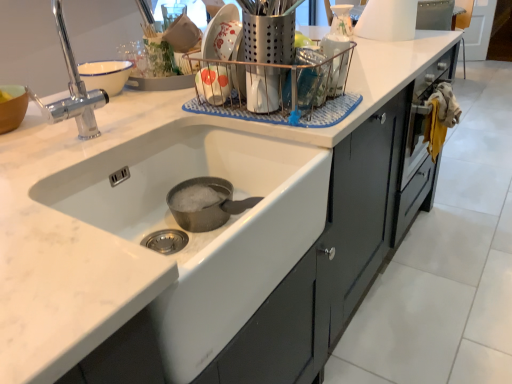
Question: From a real-world perspective, is white glossy sink at center below clear plastic container at upper center, the third appliance in the back-to-front sequence?

Choices:
 (A) yes
 (B) no

Answer: (A)

Question: Is white glossy sink at center further to camera compared to clear plastic container at upper center, the third appliance in the back-to-front sequence?

Choices:
 (A) no
 (B) yes

Answer: (A)

Question: Is white glossy sink at center not within clear plastic container at upper center, the third appliance viewed from the right?

Choices:
 (A) no
 (B) yes

Answer: (B)

Question: Can you confirm if white glossy sink at center is positioned to the left of clear plastic container at upper center, the third appliance viewed from the right?

Choices:
 (A) yes
 (B) no

Answer: (A)

Question: Is white glossy sink at center not near clear plastic container at upper center, marked as the 2th appliance in a front-to-back arrangement?

Choices:
 (A) yes
 (B) no

Answer: (B)

Question: Is clear plastic container at upper center, the second appliance in the left-to-right sequence, in front of or behind white glossy paper towel dispenser at upper right, arranged as the second appliance when viewed from the back, in the image?

Choices:
 (A) front
 (B) behind

Answer: (A)

Question: Based on their positions, is clear plastic container at upper center, marked as the 2th appliance in a front-to-back arrangement, located to the left or right of white glossy paper towel dispenser at upper right, which ranks as the 3th appliance in front-to-back order?

Choices:
 (A) right
 (B) left

Answer: (B)

Question: Is clear plastic container at upper center, the third appliance in the back-to-front sequence, taller or shorter than white glossy paper towel dispenser at upper right, which is the fourth appliance from left to right?

Choices:
 (A) short
 (B) tall

Answer: (A)

Question: Looking at their shapes, would you say clear plastic container at upper center, marked as the 2th appliance in a front-to-back arrangement, is wider or thinner than white glossy paper towel dispenser at upper right, placed as the 1th appliance when sorted from right to left?

Choices:
 (A) wide
 (B) thin

Answer: (B)

Question: From the image's perspective, is white glossy coffee pot at upper center, acting as the third appliance starting from the left, located above or below satin silver utensil holder at upper center, acting as the first appliance starting from the left?

Choices:
 (A) below
 (B) above

Answer: (B)

Question: From their relative heights in the image, would you say white glossy coffee pot at upper center, acting as the third appliance starting from the left, is taller or shorter than satin silver utensil holder at upper center, the first appliance positioned from the front?

Choices:
 (A) tall
 (B) short

Answer: (B)

Question: Considering the positions of white glossy coffee pot at upper center, the first appliance when ordered from back to front, and satin silver utensil holder at upper center, which appears as the 4th appliance when viewed from the right, in the image, is white glossy coffee pot at upper center, the first appliance when ordered from back to front, bigger or smaller than satin silver utensil holder at upper center, which appears as the 4th appliance when viewed from the right,?

Choices:
 (A) big
 (B) small

Answer: (B)

Question: Is point (340, 6) closer or farther from the camera than point (270, 99)?

Choices:
 (A) farther
 (B) closer

Answer: (A)

Question: From a real-world perspective, is white glossy sink at center above or below satin silver utensil holder at upper center, the first appliance positioned from the front?

Choices:
 (A) above
 (B) below

Answer: (B)

Question: In terms of width, does white glossy sink at center look wider or thinner when compared to satin silver utensil holder at upper center, which appears as the fourth appliance when viewed from the back?

Choices:
 (A) wide
 (B) thin

Answer: (A)